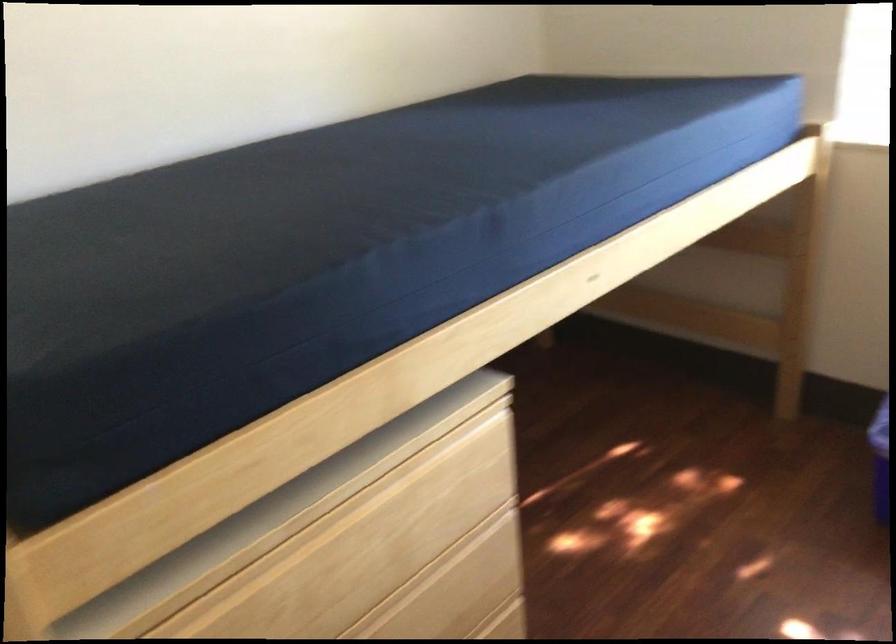
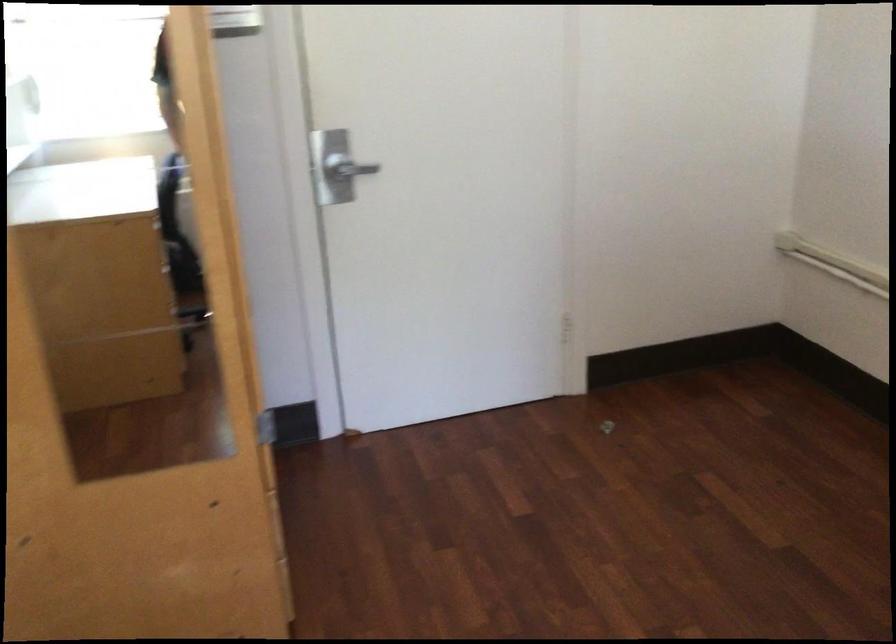
The first image is from the beginning of the video and the second image is from the end. How did the camera likely rotate when shooting the video?

The camera's rotation is toward left-down.